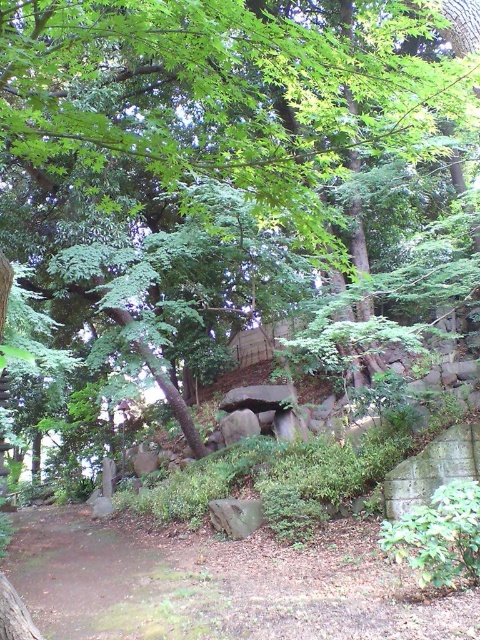
You are planning to walk along the brown dirt path at lower center and want to step over the rough gray rock at center. Based on their sizes, which one do you think will be easier to navigate around?

The brown dirt path at lower center is larger in size than the rough gray rock at center, so it will be easier to navigate around the brown dirt path at lower center.